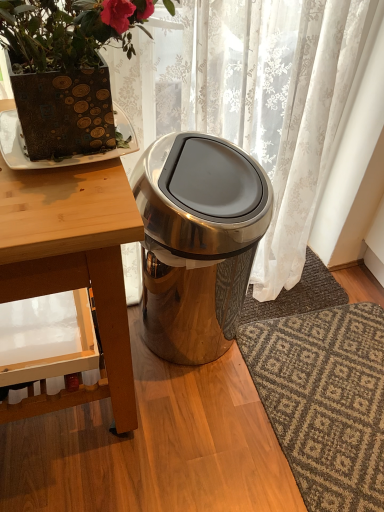
What do you see at coordinates (66, 69) in the screenshot?
I see `matte brown pot at upper left` at bounding box center [66, 69].

This screenshot has width=384, height=512. What do you see at coordinates (297, 295) in the screenshot?
I see `dark gray textured rug at lower right, which ranks as the second doormat in bottom-to-top order` at bounding box center [297, 295].

Locate an element on the screen. This screenshot has height=512, width=384. satin silver trash can at center is located at coordinates (197, 242).

In order to face wooden table at left, should I rotate leftwards or rightwards?

Turn left approximately 19.000 degrees to face it.

Measure the distance between brown textured plate at upper left and camera.

brown textured plate at upper left and camera are 30.04 inches apart.

Locate an element on the screen. brown textured plate at upper left is located at coordinates (60, 159).

Describe the element at coordinates (325, 400) in the screenshot. This screenshot has height=512, width=384. I see `brown textured rug at lower right, placed as the 2th doormat when sorted from top to bottom` at that location.

The height and width of the screenshot is (512, 384). Find the location of `matte brown pot at upper left`. matte brown pot at upper left is located at coordinates (66, 69).

The width and height of the screenshot is (384, 512). There is a matte brown pot at upper left. Identify the location of the 2nd doormat below it (from the image's perspective). (325, 400).

Are matte brown pot at upper left and brown textured rug at lower right, the first doormat positioned from the bottom, located far from each other?

matte brown pot at upper left is far away from brown textured rug at lower right, the first doormat positioned from the bottom.

Considering the sizes of objects matte brown pot at upper left and brown textured rug at lower right, the first doormat positioned from the bottom, in the image provided, who is smaller, matte brown pot at upper left or brown textured rug at lower right, the first doormat positioned from the bottom,?

Smaller between the two is brown textured rug at lower right, the first doormat positioned from the bottom.

Is wooden table at left directly adjacent to matte brown pot at upper left?

No, wooden table at left is not touching matte brown pot at upper left.

Which object is closer to the camera taking this photo, wooden table at left or matte brown pot at upper left?

Positioned in front is matte brown pot at upper left.

Which object is positioned more to the left, wooden table at left or matte brown pot at upper left?

wooden table at left is more to the left.

From the image's perspective, which one is positioned lower, wooden table at left or matte brown pot at upper left?

wooden table at left is shown below in the image.

Is satin silver trash can at center at the back of wooden table at left?

wooden table at left does not have its back to satin silver trash can at center.

From a real-world perspective, is wooden table at left on satin silver trash can at center?

Correct, in the physical world, wooden table at left is higher than satin silver trash can at center.

In the scene shown: How distant is wooden table at left from satin silver trash can at center?

31.43 centimeters.

Is satin silver trash can at center spatially inside brown textured rug at lower right, placed as the 2th doormat when sorted from top to bottom, or outside of it?

satin silver trash can at center is not enclosed by brown textured rug at lower right, placed as the 2th doormat when sorted from top to bottom.

Is satin silver trash can at center to the right of brown textured rug at lower right, the first doormat positioned from the bottom, from the viewer's perspective?

Incorrect, satin silver trash can at center is not on the right side of brown textured rug at lower right, the first doormat positioned from the bottom.

This screenshot has height=512, width=384. Find the location of `the 2nd doormat counting from the right of the satin silver trash can at center`. the 2nd doormat counting from the right of the satin silver trash can at center is located at coordinates tap(325, 400).

Which is closer to the camera, (247, 210) or (285, 353)?

Point (247, 210) appears to be closer to the viewer than point (285, 353).

From the picture: From a real-world perspective, is dark gray textured rug at lower right, which ranks as the second doormat in bottom-to-top order, above or below wooden table at left?

From a real-world perspective, dark gray textured rug at lower right, which ranks as the second doormat in bottom-to-top order, is physically below wooden table at left.

Is dark gray textured rug at lower right, the first doormat when ordered from top to bottom, positioned far away from wooden table at left?

They are positioned close to each other.

Is dark gray textured rug at lower right, which ranks as the second doormat in bottom-to-top order, aimed at wooden table at left?

No, dark gray textured rug at lower right, which ranks as the second doormat in bottom-to-top order, is not turned towards wooden table at left.

The width and height of the screenshot is (384, 512). I want to click on table that appears above the dark gray textured rug at lower right, the first doormat when ordered from top to bottom (from a real-world perspective), so pos(74,252).

Consider the image. Can you confirm if matte brown pot at upper left is positioned to the left of satin silver trash can at center?

Yes, matte brown pot at upper left is to the left of satin silver trash can at center.

From a real-world perspective, is matte brown pot at upper left located higher than satin silver trash can at center?

Yes, from a real-world perspective, matte brown pot at upper left is on top of satin silver trash can at center.

Based on the photo, considering the relative sizes of matte brown pot at upper left and satin silver trash can at center in the image provided, is matte brown pot at upper left taller than satin silver trash can at center?

No.

The width and height of the screenshot is (384, 512). What are the coordinates of `houseplant above the satin silver trash can at center (from a real-world perspective)` in the screenshot? It's located at (66, 69).

Can you tell me how much brown textured plate at upper left and brown textured rug at lower right, the first doormat positioned from the bottom, differ in facing direction?

The facing directions of brown textured plate at upper left and brown textured rug at lower right, the first doormat positioned from the bottom, are 94.4 degrees apart.

Which object is positioned more to the right, brown textured plate at upper left or brown textured rug at lower right, the first doormat positioned from the bottom?

brown textured rug at lower right, the first doormat positioned from the bottom, is more to the right.

This screenshot has height=512, width=384. Find the location of `plate above the brown textured rug at lower right, placed as the 2th doormat when sorted from top to bottom (from the image's perspective)`. plate above the brown textured rug at lower right, placed as the 2th doormat when sorted from top to bottom (from the image's perspective) is located at coordinates (60, 159).

Starting from the matte brown pot at upper left, which doormat is the 2nd one to the right? Please provide its 2D coordinates.

[(325, 400)]

There is a wooden table at left. Where is `houseplant above it (from a real-world perspective)`? The width and height of the screenshot is (384, 512). houseplant above it (from a real-world perspective) is located at coordinates pos(66,69).

When comparing their distances from brown textured rug at lower right, the first doormat positioned from the bottom, does satin silver trash can at center or matte brown pot at upper left seem closer?

Among the two, satin silver trash can at center is located nearer to brown textured rug at lower right, the first doormat positioned from the bottom.

Looking at the image, which one is located closer to brown textured plate at upper left, wooden table at left or satin silver trash can at center?

Based on the image, wooden table at left appears to be nearer to brown textured plate at upper left.

Consider the image. When comparing their distances from wooden table at left, does matte brown pot at upper left or brown textured plate at upper left seem further?

Among the two, brown textured plate at upper left is located further to wooden table at left.

Based on their spatial positions, is wooden table at left or dark gray textured rug at lower right, the first doormat when ordered from top to bottom, further from brown textured rug at lower right, the first doormat positioned from the bottom?

The object further to brown textured rug at lower right, the first doormat positioned from the bottom, is wooden table at left.

Estimate the real-world distances between objects in this image. Which object is closer to satin silver trash can at center, matte brown pot at upper left or brown textured rug at lower right, placed as the 2th doormat when sorted from top to bottom?

matte brown pot at upper left is positioned closer to the anchor satin silver trash can at center.

Estimate the real-world distances between objects in this image. Which object is closer to satin silver trash can at center, brown textured plate at upper left or brown textured rug at lower right, the first doormat positioned from the bottom?

brown textured plate at upper left.

Based on their spatial positions, is brown textured plate at upper left or wooden table at left further from matte brown pot at upper left?

wooden table at left is further to matte brown pot at upper left.

Estimate the real-world distances between objects in this image. Which object is closer to wooden table at left, dark gray textured rug at lower right, the first doormat when ordered from top to bottom, or brown textured plate at upper left?

brown textured plate at upper left is closer to wooden table at left.

Find the location of a particular element. This screenshot has width=384, height=512. plate located between matte brown pot at upper left and dark gray textured rug at lower right, which ranks as the second doormat in bottom-to-top order, in the depth direction is located at coordinates (60, 159).

Where is `plate situated between wooden table at left and satin silver trash can at center from left to right`? This screenshot has width=384, height=512. plate situated between wooden table at left and satin silver trash can at center from left to right is located at coordinates (60, 159).

Locate an element on the screen. trash bin/can that lies between matte brown pot at upper left and brown textured rug at lower right, the first doormat positioned from the bottom, from top to bottom is located at coordinates (197, 242).

Identify the location of houseplant situated between wooden table at left and brown textured rug at lower right, the first doormat positioned from the bottom, from left to right. (66, 69).